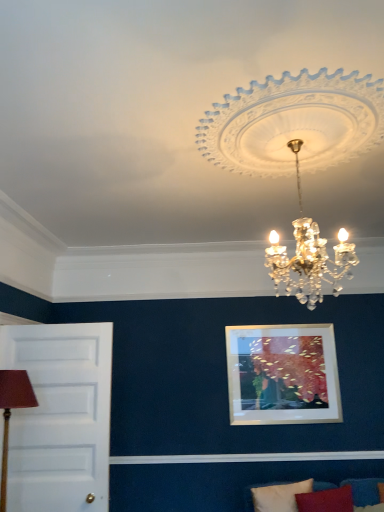
The image size is (384, 512). What do you see at coordinates (276, 496) in the screenshot?
I see `white fabric pillow at lower right` at bounding box center [276, 496].

Measure the distance between velvet blue couch at lower right and camera.

The depth of velvet blue couch at lower right is 3.11 meters.

Find the location of a particular element. The image size is (384, 512). white painted wood door at left is located at coordinates (60, 417).

Considering the positions of objects white fabric pillow at lower right and brown fabric lampshade at left in the image provided, who is behind, white fabric pillow at lower right or brown fabric lampshade at left?

white fabric pillow at lower right is more distant.

Measure the distance between white fabric pillow at lower right and brown fabric lampshade at left.

6.30 feet.

Is white fabric pillow at lower right facing towards brown fabric lampshade at left?

No, white fabric pillow at lower right is not oriented towards brown fabric lampshade at left.

Is white fabric pillow at lower right completely or partially outside of brown fabric lampshade at left?

white fabric pillow at lower right lies outside brown fabric lampshade at left's area.

From a real-world perspective, is white painted wood door at left positioned under white fabric pillow at lower right based on gravity?

Actually, white painted wood door at left is physically above white fabric pillow at lower right in the real world.

From the image's perspective, does white painted wood door at left appear higher than white fabric pillow at lower right?

Yes, from the image's perspective, white painted wood door at left is on top of white fabric pillow at lower right.

Locate an element on the screen. Image resolution: width=384 pixels, height=512 pixels. pillow located on the right of white painted wood door at left is located at coordinates (276, 496).

Is white painted wood door at left taller than white fabric pillow at lower right?

Yes, white painted wood door at left is taller than white fabric pillow at lower right.

Which object is closer to the camera, velvet blue couch at lower right or white fabric pillow at lower right?

Positioned in front is velvet blue couch at lower right.

In terms of width, does velvet blue couch at lower right look wider or thinner when compared to white fabric pillow at lower right?

In the image, velvet blue couch at lower right appears to be wider than white fabric pillow at lower right.

Between velvet blue couch at lower right and white fabric pillow at lower right, which one has larger size?

velvet blue couch at lower right is bigger.

Looking at this image, from the image's perspective, which one is positioned higher, white painted wood door at left or velvet blue couch at lower right?

white painted wood door at left appears higher in the image.

Is white painted wood door at left to the left of velvet blue couch at lower right from the viewer's perspective?

Yes, white painted wood door at left is to the left of velvet blue couch at lower right.

This screenshot has width=384, height=512. I want to click on couch below the white painted wood door at left (from the image's perspective), so click(x=364, y=490).

Looking at this image, is white painted wood door at left facing towards velvet blue couch at lower right?

No, white painted wood door at left is not turned towards velvet blue couch at lower right.

Visually, is white painted wood door at left positioned to the left or to the right of brown fabric lampshade at left?

Clearly, white painted wood door at left is on the right of brown fabric lampshade at left in the image.

Does white painted wood door at left contain brown fabric lampshade at left?

No.

From a real-world perspective, between white painted wood door at left and brown fabric lampshade at left, who is vertically higher?

From a 3D spatial view, white painted wood door at left is above.

How much distance is there between white painted wood door at left and brown fabric lampshade at left?

white painted wood door at left is 22.65 inches away from brown fabric lampshade at left.

From a real-world perspective, who is located lower, white painted wood door at left or white crystal chandelier at upper center?

From a 3D spatial view, white painted wood door at left is below.

How much distance is there between white painted wood door at left and white crystal chandelier at upper center?

white painted wood door at left and white crystal chandelier at upper center are 7.18 feet apart from each other.

Is white painted wood door at left positioned with its back to white crystal chandelier at upper center?

No, white painted wood door at left is not facing the opposite direction of white crystal chandelier at upper center.

Is white crystal chandelier at upper center at the back of velvet blue couch at lower right?

No, velvet blue couch at lower right is not facing away from white crystal chandelier at upper center.

Are velvet blue couch at lower right and white crystal chandelier at upper center making contact?

No, velvet blue couch at lower right is not next to white crystal chandelier at upper center.

From a real-world perspective, which object stands above the other?

white crystal chandelier at upper center.

In order to click on pillow located underneath the brown fabric lampshade at left (from a real-world perspective) in this screenshot , I will do `click(276, 496)`.

Where is `pillow on the right of white painted wood door at left`? This screenshot has width=384, height=512. pillow on the right of white painted wood door at left is located at coordinates (276, 496).

Estimate the real-world distances between objects in this image. Which object is further from white painted wood door at left, brown fabric lampshade at left or white fabric pillow at lower right?

The object further to white painted wood door at left is white fabric pillow at lower right.

From the image, which object appears to be nearer to white fabric pillow at lower right, white painted wood door at left or velvet blue couch at lower right?

The object closer to white fabric pillow at lower right is velvet blue couch at lower right.

Considering their positions, is brown fabric lampshade at left positioned further to white painted wood door at left than white crystal chandelier at upper center?

Based on the image, white crystal chandelier at upper center appears to be further to white painted wood door at left.

Estimate the real-world distances between objects in this image. Which object is further from white fabric pillow at lower right, white crystal chandelier at upper center or brown fabric lampshade at left?

Among the two, white crystal chandelier at upper center is located further to white fabric pillow at lower right.

Estimate the real-world distances between objects in this image. Which object is further from white fabric pillow at lower right, brown fabric lampshade at left or velvet blue couch at lower right?

The object further to white fabric pillow at lower right is brown fabric lampshade at left.

When comparing their distances from white painted wood door at left, does velvet blue couch at lower right or white fabric pillow at lower right seem closer?

The object closer to white painted wood door at left is white fabric pillow at lower right.

When comparing their distances from brown fabric lampshade at left, does velvet blue couch at lower right or white painted wood door at left seem further?

Among the two, velvet blue couch at lower right is located further to brown fabric lampshade at left.

From the image, which object appears to be farther from white painted wood door at left, white fabric pillow at lower right or white crystal chandelier at upper center?

white crystal chandelier at upper center.

Locate an element on the screen. pillow located between white painted wood door at left and velvet blue couch at lower right in the left-right direction is located at coordinates (276, 496).

The image size is (384, 512). Find the location of `door located between brown fabric lampshade at left and white fabric pillow at lower right in the left-right direction`. door located between brown fabric lampshade at left and white fabric pillow at lower right in the left-right direction is located at coordinates (60, 417).

You are a GUI agent. You are given a task and a screenshot of the screen. Output one action in this format:
    pyautogui.click(x=<x>, y=<y>)
    Task: Click on the door between brown fabric lampshade at left and velvet blue couch at lower right from left to right
    The image size is (384, 512).
    Given the screenshot: What is the action you would take?
    pyautogui.click(x=60, y=417)

This screenshot has height=512, width=384. I want to click on door that lies between white crystal chandelier at upper center and white fabric pillow at lower right from top to bottom, so click(60, 417).